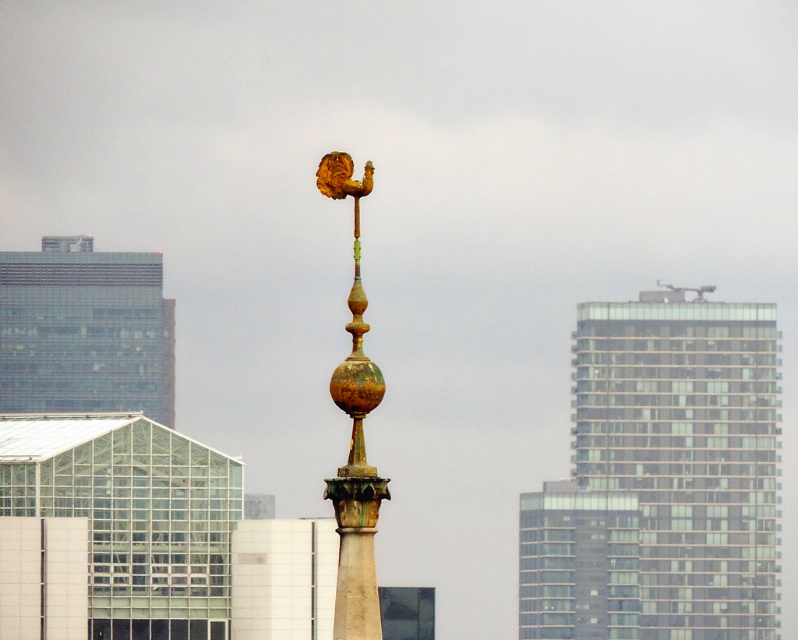
Question: Which point is farther to the camera?

Choices:
 (A) (368, 502)
 (B) (123, 337)

Answer: (B)

Question: Which point is farther to the camera?

Choices:
 (A) (141, 301)
 (B) (350, 621)

Answer: (A)

Question: Can you confirm if glassy concrete skyscraper at upper right is bigger than gold/green patina spire at center?

Choices:
 (A) no
 (B) yes

Answer: (A)

Question: Does glassy concrete skyscraper at upper right have a larger size compared to glassy reflective building at left?

Choices:
 (A) yes
 (B) no

Answer: (A)

Question: Is glassy concrete skyscraper at upper right smaller than gold/green patina spire at center?

Choices:
 (A) yes
 (B) no

Answer: (A)

Question: Which of these objects is positioned farthest from the gold/green patina spire at center?

Choices:
 (A) glassy reflective building at left
 (B) glassy concrete skyscraper at upper right

Answer: (B)